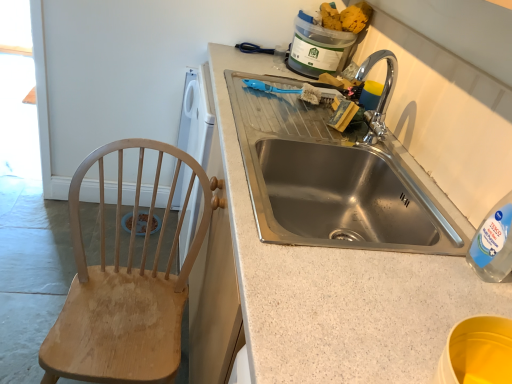
Question: Can you confirm if granite countertop at center is bigger than stainless steel sink at center?

Choices:
 (A) yes
 (B) no

Answer: (A)

Question: Does granite countertop at center have a smaller size compared to stainless steel sink at center?

Choices:
 (A) yes
 (B) no

Answer: (B)

Question: Can you confirm if granite countertop at center is taller than stainless steel sink at center?

Choices:
 (A) yes
 (B) no

Answer: (A)

Question: Considering the relative sizes of granite countertop at center and stainless steel sink at center in the image provided, is granite countertop at center thinner than stainless steel sink at center?

Choices:
 (A) no
 (B) yes

Answer: (A)

Question: From the image's perspective, is granite countertop at center over stainless steel sink at center?

Choices:
 (A) yes
 (B) no

Answer: (B)

Question: Considering the relative positions of granite countertop at center and stainless steel sink at center in the image provided, is granite countertop at center to the left of stainless steel sink at center from the viewer's perspective?

Choices:
 (A) no
 (B) yes

Answer: (B)

Question: Would you say wooden chair at left contains granite countertop at center?

Choices:
 (A) no
 (B) yes

Answer: (A)

Question: Does wooden chair at left have a smaller size compared to granite countertop at center?

Choices:
 (A) yes
 (B) no

Answer: (A)

Question: From the image's perspective, does wooden chair at left appear higher than granite countertop at center?

Choices:
 (A) yes
 (B) no

Answer: (B)

Question: Considering the relative sizes of wooden chair at left and granite countertop at center in the image provided, is wooden chair at left thinner than granite countertop at center?

Choices:
 (A) no
 (B) yes

Answer: (B)

Question: From the image's perspective, is wooden chair at left located beneath granite countertop at center?

Choices:
 (A) yes
 (B) no

Answer: (A)

Question: Is wooden chair at left shorter than granite countertop at center?

Choices:
 (A) yes
 (B) no

Answer: (A)

Question: Does yellow sponge at upper right appear on the left side of stainless steel sink at center?

Choices:
 (A) no
 (B) yes

Answer: (A)